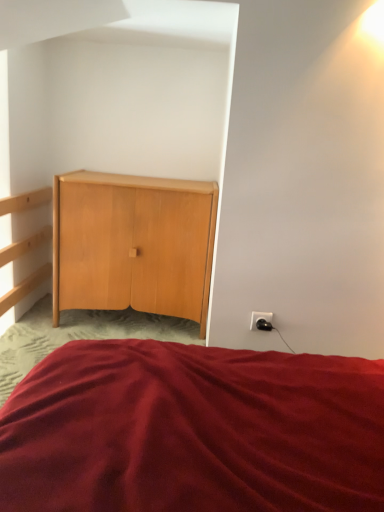
Question: Does burgundy fabric bed at center lie in front of black plastic outlet at lower right?

Choices:
 (A) no
 (B) yes

Answer: (B)

Question: From the image's perspective, would you say burgundy fabric bed at center is positioned over black plastic outlet at lower right?

Choices:
 (A) yes
 (B) no

Answer: (B)

Question: Are burgundy fabric bed at center and black plastic outlet at lower right making contact?

Choices:
 (A) no
 (B) yes

Answer: (A)

Question: From a real-world perspective, does burgundy fabric bed at center sit lower than black plastic outlet at lower right?

Choices:
 (A) no
 (B) yes

Answer: (B)

Question: Is burgundy fabric bed at center wider than black plastic outlet at lower right?

Choices:
 (A) yes
 (B) no

Answer: (A)

Question: Does burgundy fabric bed at center have a lesser height compared to black plastic outlet at lower right?

Choices:
 (A) no
 (B) yes

Answer: (A)

Question: Is burgundy fabric bed at center outside of light wood cabinet at center?

Choices:
 (A) yes
 (B) no

Answer: (A)

Question: Can you confirm if burgundy fabric bed at center is wider than light wood cabinet at center?

Choices:
 (A) yes
 (B) no

Answer: (A)

Question: Could you tell me if burgundy fabric bed at center is turned towards light wood cabinet at center?

Choices:
 (A) yes
 (B) no

Answer: (B)

Question: From a real-world perspective, does burgundy fabric bed at center sit lower than light wood cabinet at center?

Choices:
 (A) no
 (B) yes

Answer: (B)

Question: Does burgundy fabric bed at center lie in front of light wood cabinet at center?

Choices:
 (A) yes
 (B) no

Answer: (A)

Question: Does burgundy fabric bed at center have a smaller size compared to light wood cabinet at center?

Choices:
 (A) no
 (B) yes

Answer: (A)

Question: Does light wood cabinet at center have a lesser height compared to burgundy fabric bed at center?

Choices:
 (A) no
 (B) yes

Answer: (A)